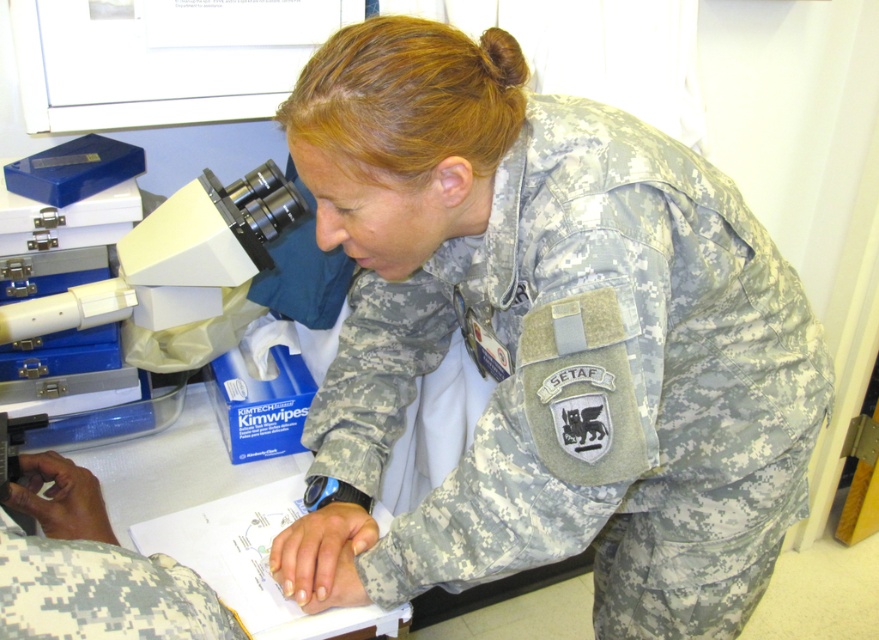
Question: Among these points, which one is nearest to the camera?

Choices:
 (A) (408, 284)
 (B) (86, 317)

Answer: (B)

Question: From the image, what is the correct spatial relationship of camouflage fabric uniform at center in relation to white plastic microscope at left?

Choices:
 (A) left
 (B) right

Answer: (B)

Question: Where is camouflage fabric uniform at center located in relation to white plastic microscope at left in the image?

Choices:
 (A) left
 (B) right

Answer: (B)

Question: Which of the following is the closest to the observer?

Choices:
 (A) camouflage fabric uniform at center
 (B) white plastic microscope at left

Answer: (A)

Question: Is camouflage fabric uniform at center thinner than white plastic microscope at left?

Choices:
 (A) no
 (B) yes

Answer: (A)